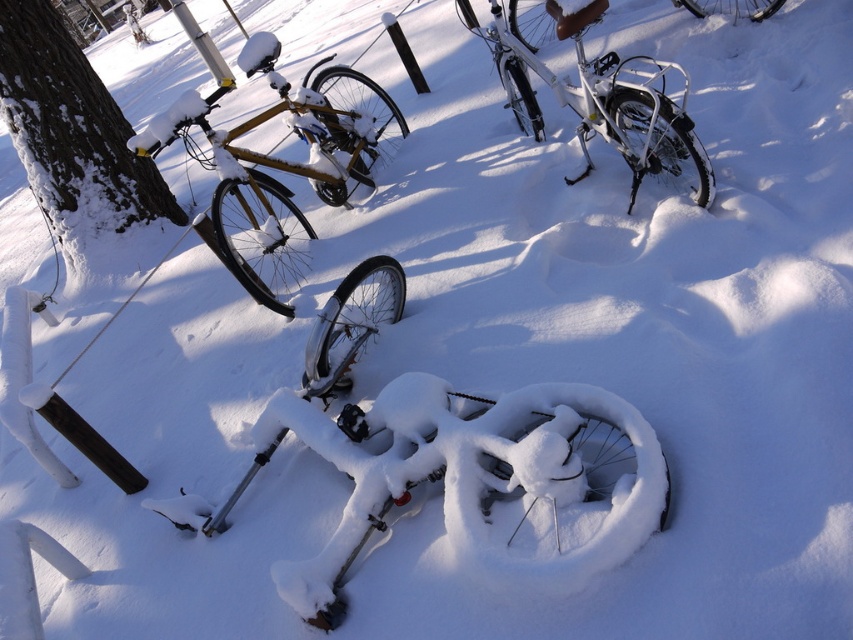
Does dark brown bark tree at left have a smaller size compared to white matte bicycle at upper center?

Incorrect, dark brown bark tree at left is not smaller in size than white matte bicycle at upper center.

Is dark brown bark tree at left positioned at the back of white matte bicycle at upper center?

Yes, it is behind white matte bicycle at upper center.

What do you see at coordinates (76, 147) in the screenshot?
I see `dark brown bark tree at left` at bounding box center [76, 147].

The width and height of the screenshot is (853, 640). I want to click on dark brown bark tree at left, so click(76, 147).

Does dark brown bark tree at left appear on the left side of shiny gold bicycle at left?

Correct, you'll find dark brown bark tree at left to the left of shiny gold bicycle at left.

Is point (53, 116) in front of point (259, 196)?

No, it is behind (259, 196).

Where is `dark brown bark tree at left`? This screenshot has width=853, height=640. dark brown bark tree at left is located at coordinates (76, 147).

Locate an element on the screen. The image size is (853, 640). dark brown bark tree at left is located at coordinates (76, 147).

Looking at this image, does shiny gold bicycle at left have a larger size compared to white matte bicycle at upper center?

Indeed, shiny gold bicycle at left has a larger size compared to white matte bicycle at upper center.

Can you confirm if shiny gold bicycle at left is smaller than white matte bicycle at upper center?

No.

You are a GUI agent. You are given a task and a screenshot of the screen. Output one action in this format:
    pyautogui.click(x=<x>, y=<y>)
    Task: Click on the shiny gold bicycle at left
    Image resolution: width=853 pixels, height=640 pixels.
    Given the screenshot: What is the action you would take?
    pyautogui.click(x=277, y=166)